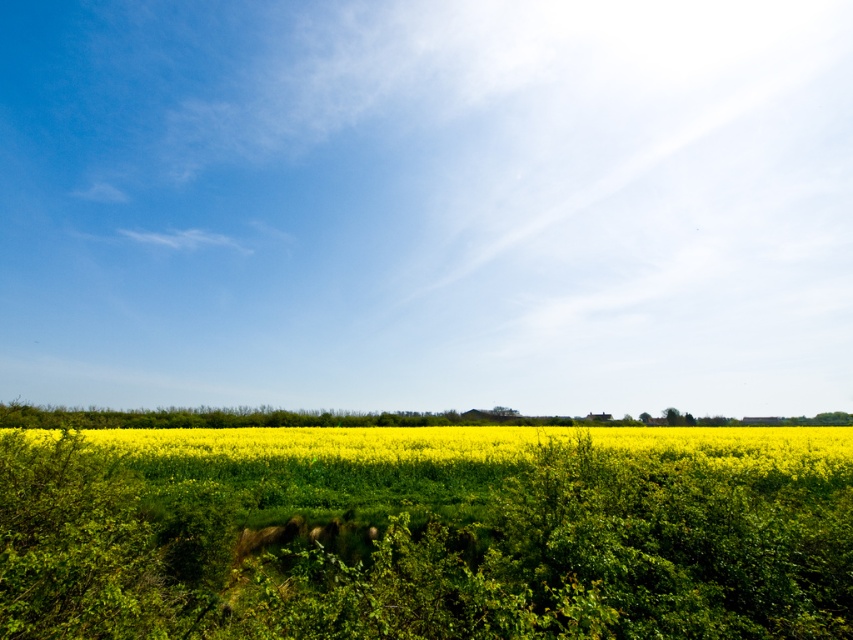
Is blue sky at upper center shorter than yellow matte flower at center?

No.

Is point (360, 61) positioned after point (286, 445)?

Yes, it is.

This screenshot has height=640, width=853. What are the coordinates of `blue sky at upper center` in the screenshot? It's located at (427, 205).